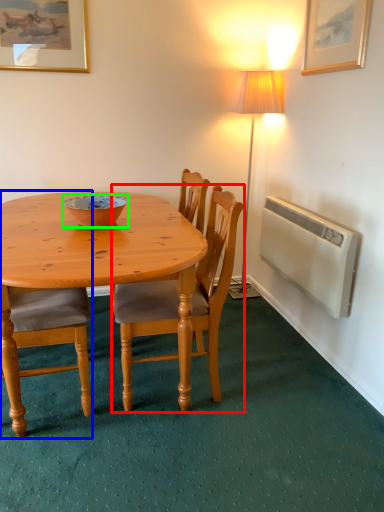
Question: Based on their relative distances, which object is nearer to chair (highlighted by a red box)? Choose from chair (highlighted by a blue box) and bowl (highlighted by a green box).

Choices:
 (A) chair
 (B) bowl

Answer: (A)